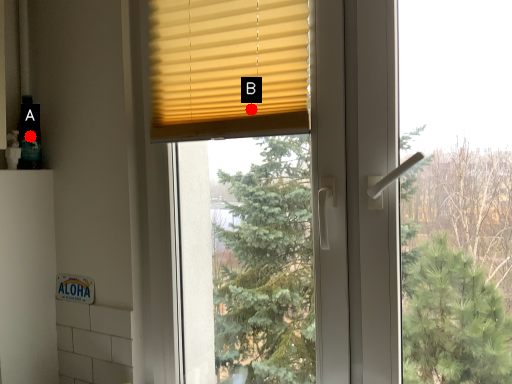
Question: Two points are circled on the image, labeled by A and B beside each circle. Which point is closer to the camera?

Choices:
 (A) A is closer
 (B) B is closer

Answer: (B)